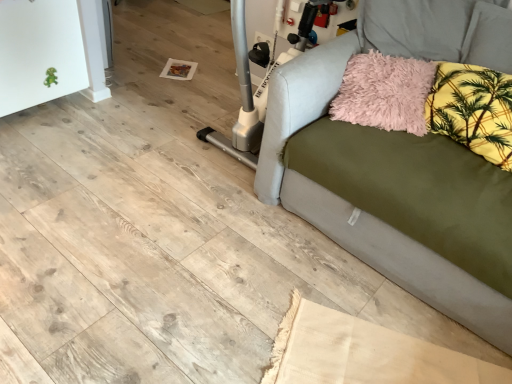
Where is `vacant point to the left of olive green fabric couch at right`? Image resolution: width=512 pixels, height=384 pixels. vacant point to the left of olive green fabric couch at right is located at coordinates (136, 186).